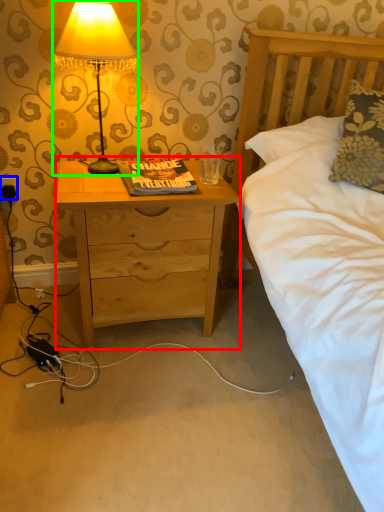
Question: Estimate the real-world distances between objects in this image. Which object is farther from nightstand (highlighted by a red box), electric outlet (highlighted by a blue box) or lamp (highlighted by a green box)?

Choices:
 (A) electric outlet
 (B) lamp

Answer: (A)